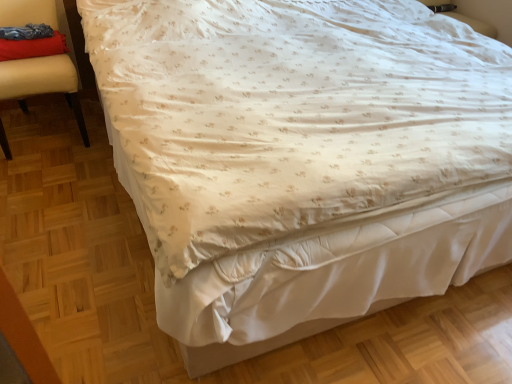
Question: Is velvet red pillow at upper left positioned with its back to velvet red cushion at left?

Choices:
 (A) yes
 (B) no

Answer: (A)

Question: Is velvet red pillow at upper left with velvet red cushion at left?

Choices:
 (A) no
 (B) yes

Answer: (B)

Question: Can you confirm if velvet red pillow at upper left is bigger than velvet red cushion at left?

Choices:
 (A) yes
 (B) no

Answer: (B)

Question: Are velvet red pillow at upper left and velvet red cushion at left located far from each other?

Choices:
 (A) no
 (B) yes

Answer: (A)

Question: Does velvet red pillow at upper left lie behind velvet red cushion at left?

Choices:
 (A) yes
 (B) no

Answer: (A)

Question: Is velvet red pillow at upper left thinner than velvet red cushion at left?

Choices:
 (A) yes
 (B) no

Answer: (A)

Question: Is velvet red cushion at left bigger than velvet red pillow at upper left?

Choices:
 (A) no
 (B) yes

Answer: (B)

Question: Does velvet red cushion at left lie in front of velvet red pillow at upper left?

Choices:
 (A) no
 (B) yes

Answer: (B)

Question: Does velvet red cushion at left appear on the right side of velvet red pillow at upper left?

Choices:
 (A) no
 (B) yes

Answer: (A)

Question: Considering the relative sizes of velvet red cushion at left and velvet red pillow at upper left in the image provided, is velvet red cushion at left smaller than velvet red pillow at upper left?

Choices:
 (A) yes
 (B) no

Answer: (B)

Question: Is velvet red cushion at left beside velvet red pillow at upper left?

Choices:
 (A) no
 (B) yes

Answer: (B)

Question: Considering the relative sizes of velvet red cushion at left and velvet red pillow at upper left in the image provided, is velvet red cushion at left shorter than velvet red pillow at upper left?

Choices:
 (A) no
 (B) yes

Answer: (A)

Question: In terms of width, does velvet red pillow at upper left look wider or thinner when compared to velvet red cushion at left?

Choices:
 (A) thin
 (B) wide

Answer: (A)